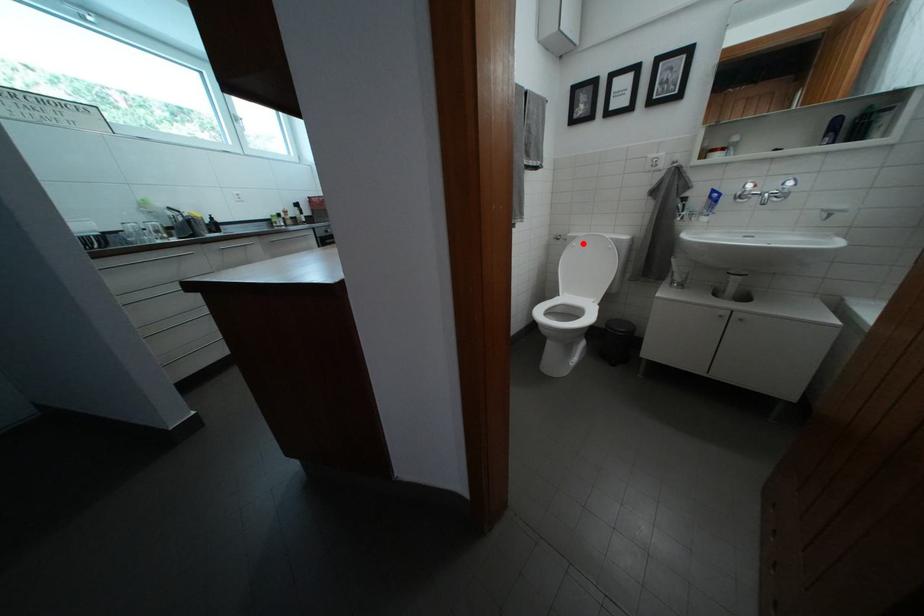
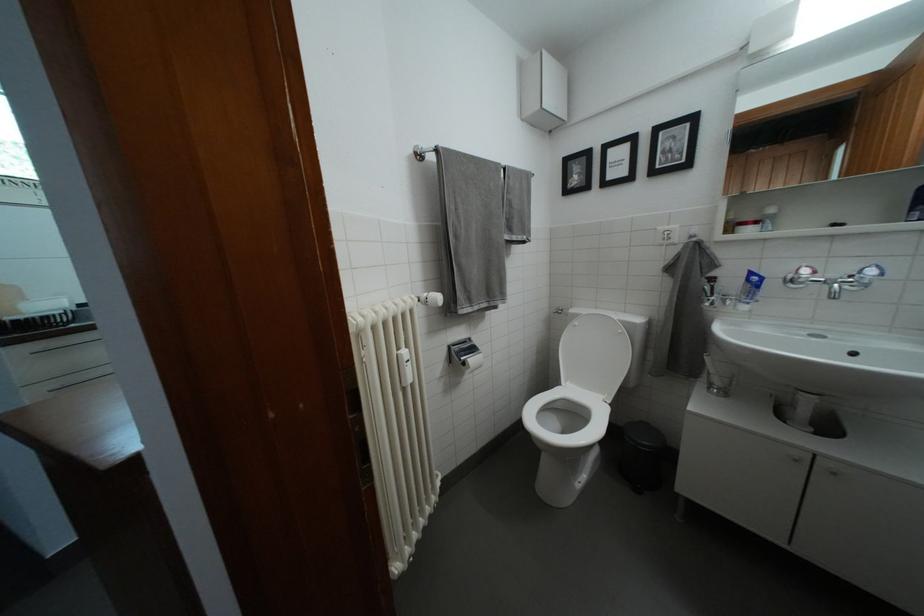
Where in the second image is the point corresponding to the highlighted location from the first image?

(585, 321)